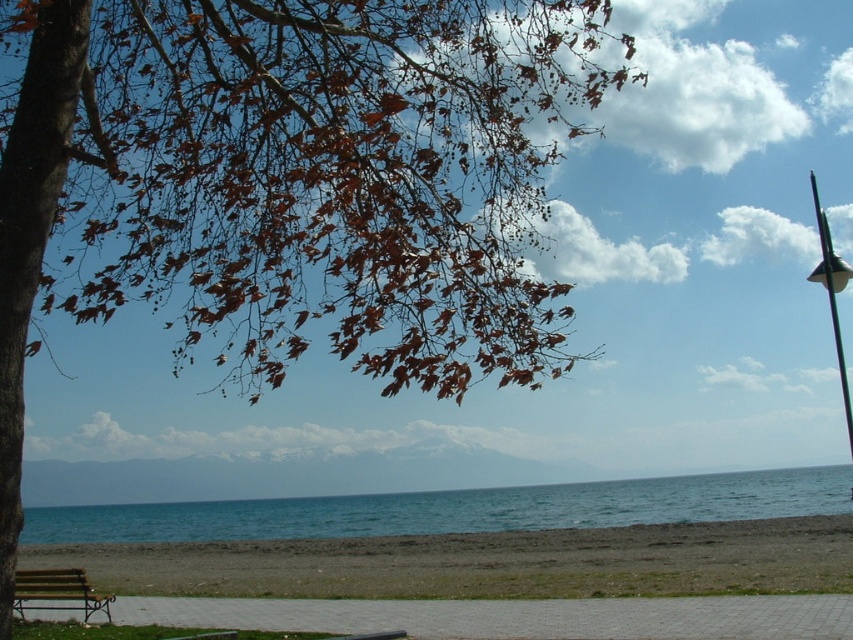
Question: Which point appears closest to the camera in this image?

Choices:
 (A) (99, 534)
 (B) (54, 589)

Answer: (B)

Question: Based on their relative distances, which object is farther from the brown sand at lower left?

Choices:
 (A) wooden park bench at lower left
 (B) blue water at center

Answer: (A)

Question: Is blue water at center bigger than wooden park bench at lower left?

Choices:
 (A) yes
 (B) no

Answer: (A)

Question: From the image, what is the correct spatial relationship of blue water at center in relation to wooden park bench at lower left?

Choices:
 (A) left
 (B) right

Answer: (B)

Question: Can you confirm if blue water at center is bigger than wooden park bench at lower left?

Choices:
 (A) no
 (B) yes

Answer: (B)

Question: Which is nearer to the brown sand at lower left?

Choices:
 (A) blue water at center
 (B) wooden park bench at lower left

Answer: (A)